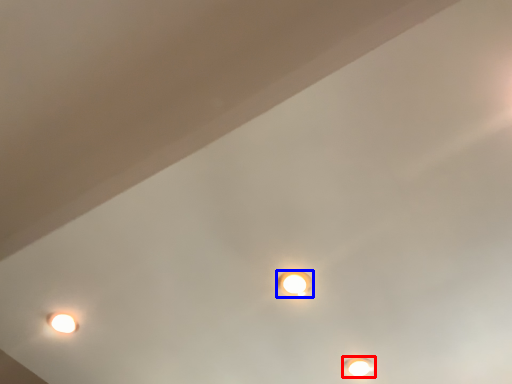
Question: Which object is further to the camera taking this photo, lamp (highlighted by a red box) or lamp (highlighted by a blue box)?

Choices:
 (A) lamp
 (B) lamp

Answer: (A)